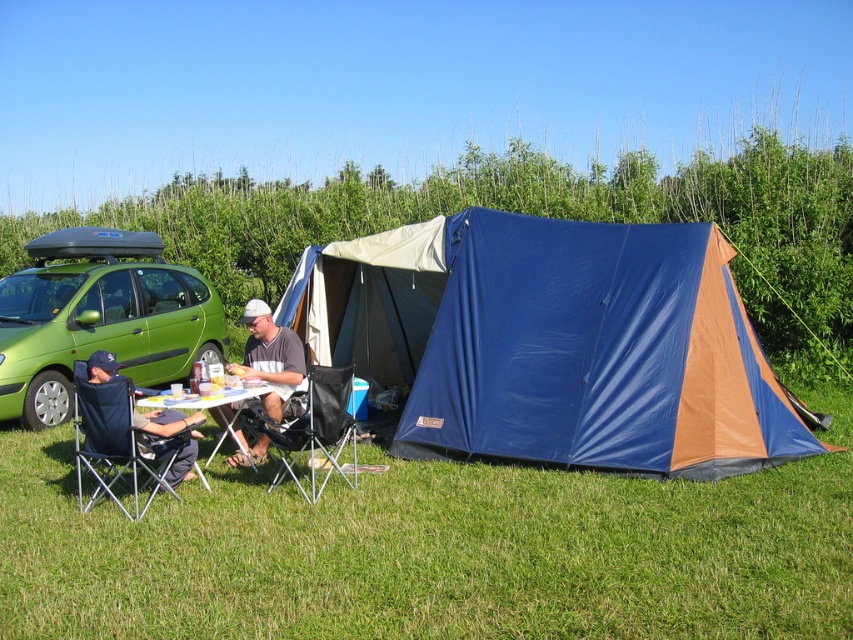
Consider the image. You are a photographer trying to capture a photo of the black fabric chair at center and the white fabric shirt at center. Which object should you focus on first if you want to ensure both are in sharp focus, considering their heights?

The black fabric chair at center is much taller than the white fabric shirt at center. To ensure both are in sharp focus, focus on the black fabric chair at center first since it is taller and likely further away.

You are standing at the point with coordinates point (x=553, y=342). Looking around, you see the blue tarpaulin tent at center. What object are you standing on?

You are standing on the blue tarpaulin tent at center, as the point (x=553, y=342) corresponds to this object according to the description.

You are planning to set up a tent in this camping scene. You have two chairs, the dark blue fabric chair at lower left and the black fabric chair at center. Which chair is located to the left of the other?

The dark blue fabric chair at lower left is positioned on the left side of the black fabric chair at center.